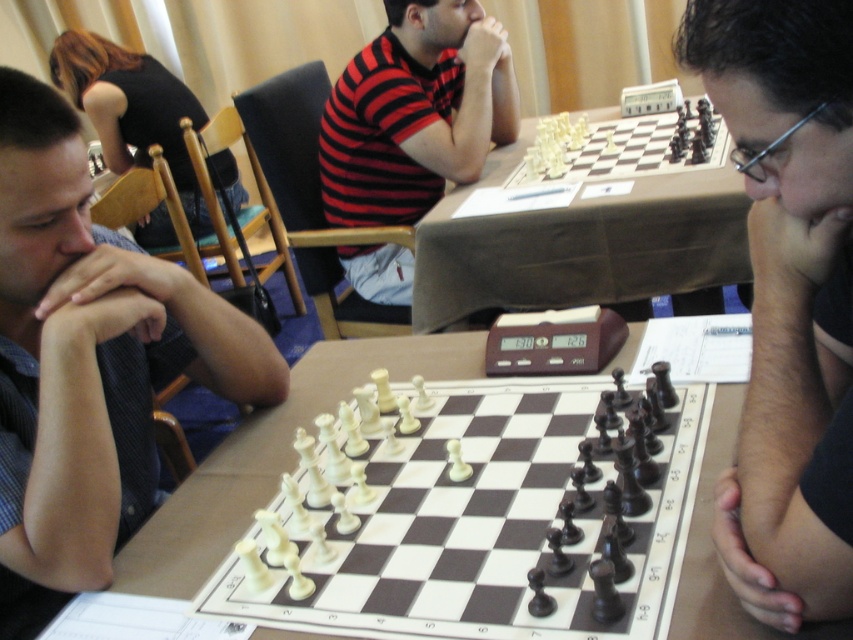
Is brown fabric table at center above striped cotton shirt at center?

No, brown fabric table at center is not above striped cotton shirt at center.

Between brown fabric table at center and striped cotton shirt at center, which one has more height?

Standing taller between the two is striped cotton shirt at center.

This screenshot has height=640, width=853. Find the location of `brown fabric table at center`. brown fabric table at center is located at coordinates (579, 244).

In the scene shown: Can you confirm if brown fabric table at center is taller than white wooden table at center?

Yes, brown fabric table at center is taller than white wooden table at center.

Does point (703, 220) come closer to viewer compared to point (463, 353)?

No.

You are a GUI agent. You are given a task and a screenshot of the screen. Output one action in this format:
    pyautogui.click(x=<x>, y=<y>)
    Task: Click on the brown fabric table at center
    This screenshot has height=640, width=853.
    Given the screenshot: What is the action you would take?
    click(x=579, y=244)

Image resolution: width=853 pixels, height=640 pixels. What do you see at coordinates (86, 364) in the screenshot?
I see `blue striped shirt at left` at bounding box center [86, 364].

Is point (94, 230) in front of point (560, 154)?

Yes, point (94, 230) is in front of point (560, 154).

Where is `blue striped shirt at left`? The width and height of the screenshot is (853, 640). blue striped shirt at left is located at coordinates (86, 364).